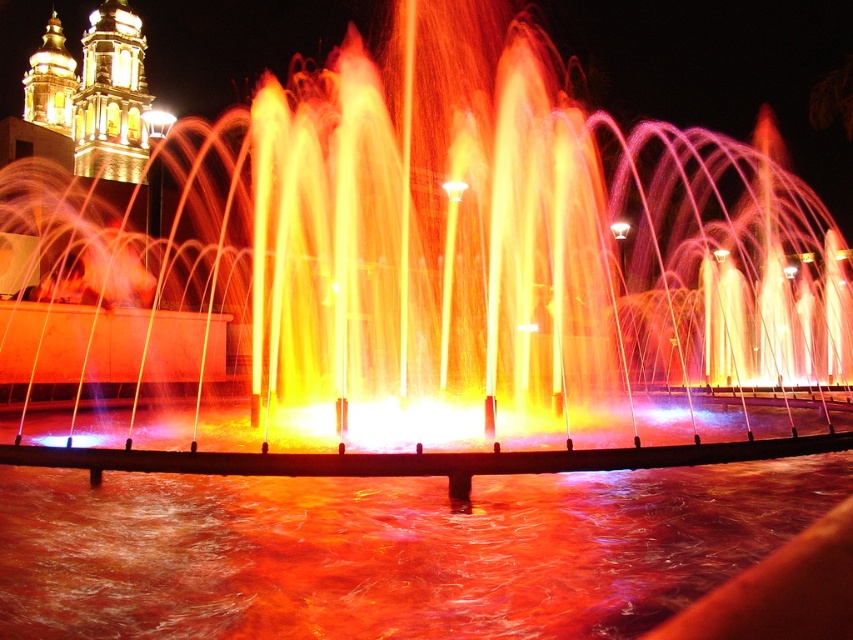
You are standing in the square facing the fountain. There are two features at the center of the fountain. One is metallic water jets at center and the other is shiny orange water at center. Which one is positioned to the left when viewed from your perspective?

The metallic water jets at center is positioned to the left of the shiny orange water at center.

You are standing at the edge of the fountain and want to take a photo of the metallic water jets at center. If your camera has a maximum focus range of 250 feet, will you be able to capture the jets clearly?

The metallic water jets at center are 272.63 feet away from the viewer. Since this distance exceeds the camera maximum focus range of 250 feet, the viewer will not be able to capture the jets clearly.

You are at the fountain and want to know which object is taller between the metallic water jets at center and the shiny orange water at center. Can you tell me?

The metallic water jets at center is much taller as shiny orange water at center.